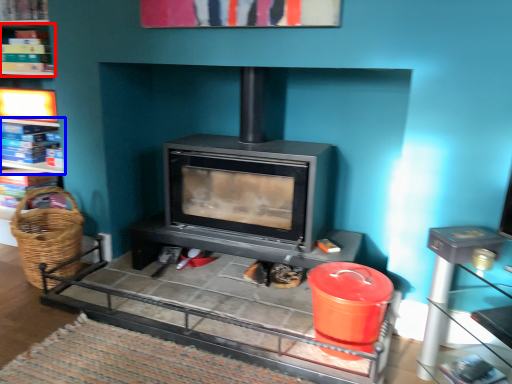
Question: Which object is closer to the camera taking this photo, shelf (highlighted by a red box) or shelf (highlighted by a blue box)?

Choices:
 (A) shelf
 (B) shelf

Answer: (A)